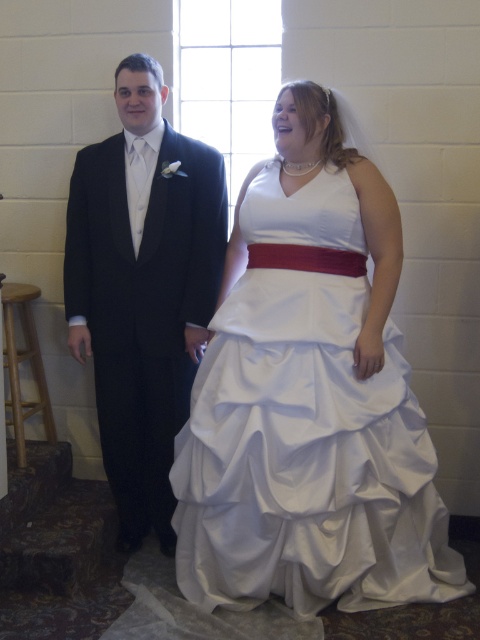
Is white satin dress at center wider than black satin suit at left?

Yes, white satin dress at center is wider than black satin suit at left.

Is point (360, 577) positioned behind point (155, 212)?

No, it is in front of (155, 212).

What do you see at coordinates (307, 460) in the screenshot? This screenshot has width=480, height=640. I see `white satin dress at center` at bounding box center [307, 460].

Find the location of a particular element. white satin dress at center is located at coordinates (307, 460).